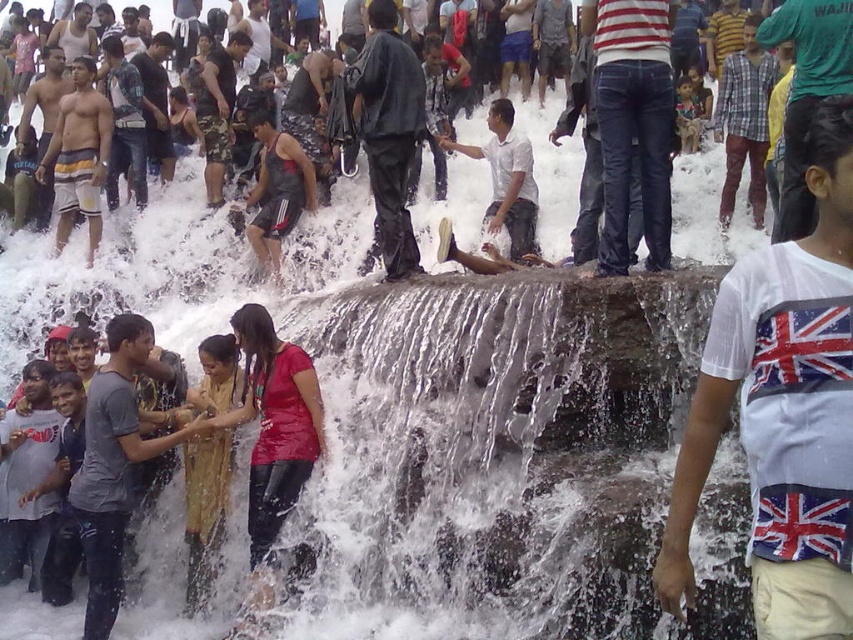
Question: Which point is closer to the camera taking this photo?

Choices:
 (A) (194, 524)
 (B) (97, 419)
 (C) (492, 145)
 (D) (363, 90)

Answer: (B)

Question: Is matte black jacket at upper center thinner than black matte pants at center?

Choices:
 (A) yes
 (B) no

Answer: (B)

Question: Can you confirm if matte black jacket at upper center is positioned above red matte shirt at center?

Choices:
 (A) yes
 (B) no

Answer: (A)

Question: Considering the real-world distances, which object is farthest from the white cotton t-shirt at center?

Choices:
 (A) matte black shorts at center
 (B) striped shorts at left
 (C) black matte pants at center
 (D) gray cotton t-shirt at lower left

Answer: (B)

Question: Can you confirm if black matte pants at center is smaller than striped shorts at left?

Choices:
 (A) yes
 (B) no

Answer: (B)

Question: Which of the following is the farthest from the observer?

Choices:
 (A) matte black shorts at center
 (B) white cotton t-shirt at center
 (C) striped shorts at left

Answer: (C)